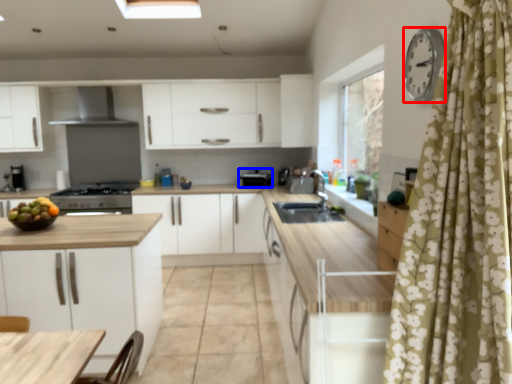
Question: Which of the following is the farthest to the observer, clock (highlighted by a red box) or appliance (highlighted by a blue box)?

Choices:
 (A) clock
 (B) appliance

Answer: (B)